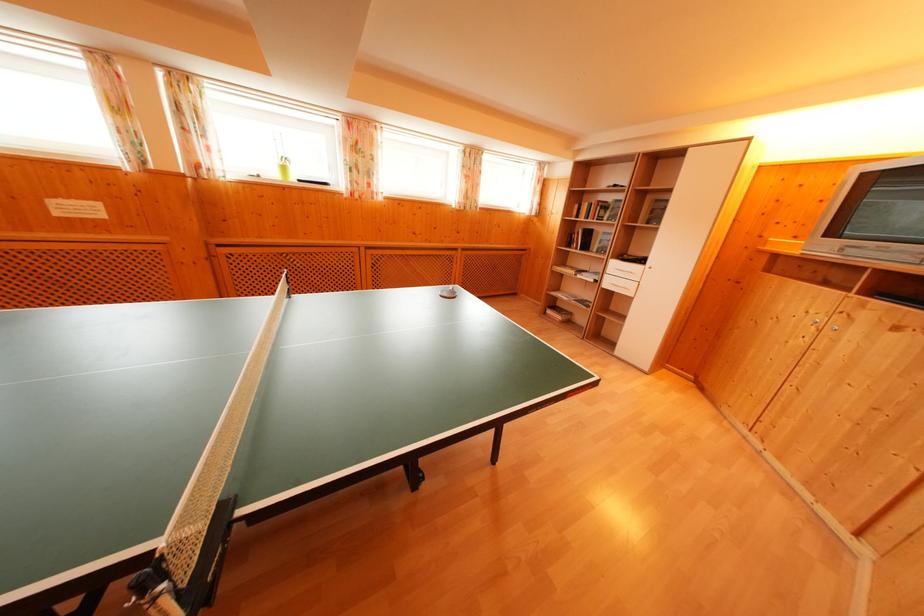
Find the location of a particular element. The width and height of the screenshot is (924, 616). net tensioner knob is located at coordinates (150, 586).